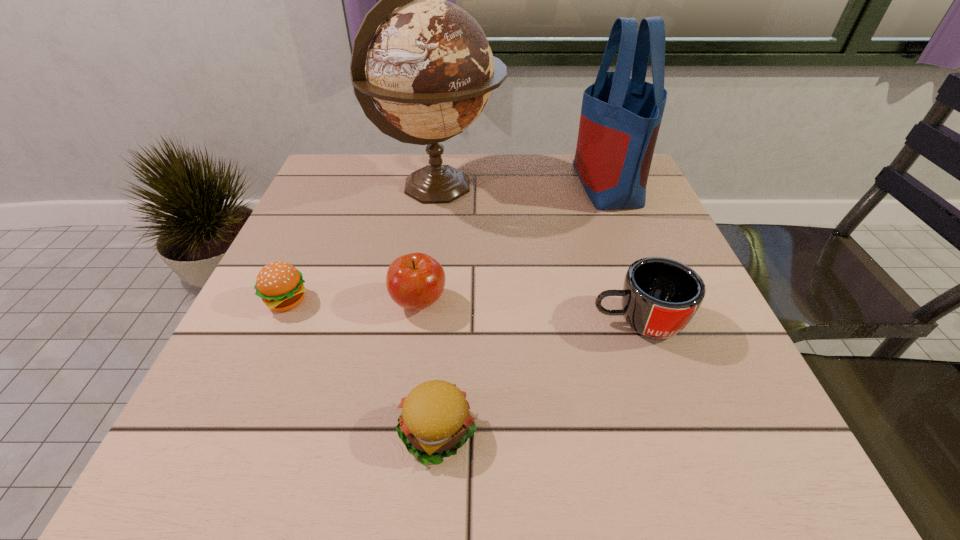
Where is `globe`? The height and width of the screenshot is (540, 960). globe is located at coordinates (426, 64).

Where is `the fifth shortest object`? The height and width of the screenshot is (540, 960). the fifth shortest object is located at coordinates (620, 119).

Where is `apple`? The width and height of the screenshot is (960, 540). apple is located at coordinates (415, 281).

Identify the location of mug. (660, 296).

Identify the location of the leftmost object. The height and width of the screenshot is (540, 960). (280, 285).

Locate an element on the screen. the left hamburger is located at coordinates (280, 285).

At what (x,y) coordinates should I click in order to perform the action: click on the right hamburger. Please return your answer as a coordinate pair (x, y). Looking at the image, I should click on click(x=435, y=421).

Where is `the nearest object`? The width and height of the screenshot is (960, 540). the nearest object is located at coordinates (435, 421).

Identify the location of free spot located 0.230m on the front of the globe showing Asia. Image resolution: width=960 pixels, height=540 pixels. (590, 187).

You are a GUI agent. You are given a task and a screenshot of the screen. Output one action in this format:
    pyautogui.click(x=<x>, y=<y>)
    Task: Click on the vacant position located 0.340m on the left of the handbag
    Image resolution: width=960 pixels, height=540 pixels.
    Given the screenshot: What is the action you would take?
    pos(441,184)